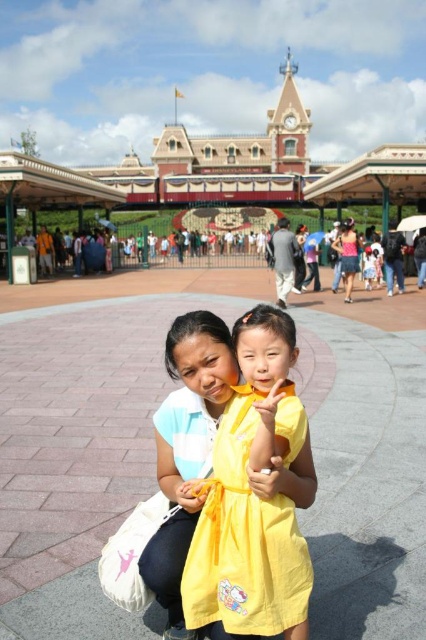
You are a photographer at Disneyland and want to capture both the yellow cotton dress at center and the pink fabric skirt at center in a single frame. Which of the two items will appear smaller in the photo?

The yellow cotton dress at center will appear smaller in the photo because it occupies less space than the pink fabric skirt at center.